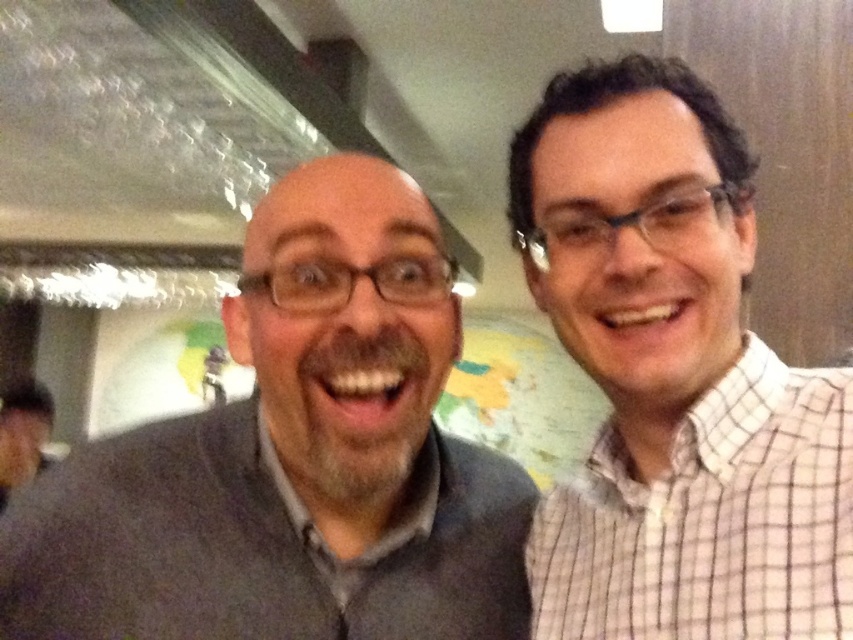
You are organizing a clothing donation drive and need to categorize the gray sweater at left and the white checkered shirt at right based on their sizes. Which clothing item has a larger size?

The gray sweater at left has a larger size compared to the white checkered shirt at right according to the description.

You are standing in the room and want to place a small plant at point (293,458). The gray sweater at left is located there. Can you put the plant there?

The gray sweater at left is located at point (293,458), so you cannot place the plant there as it is already occupied by the gray sweater at left.